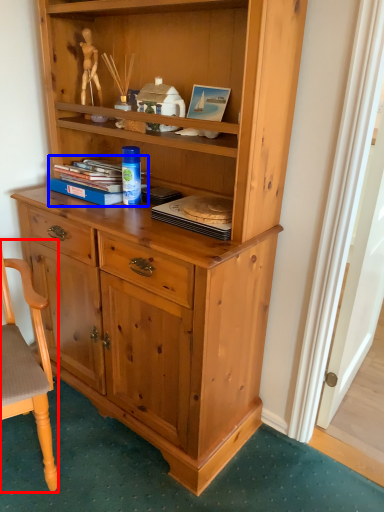
Question: Among these objects, which one is nearest to the camera, chair (highlighted by a red box) or book (highlighted by a blue box)?

Choices:
 (A) chair
 (B) book

Answer: (A)